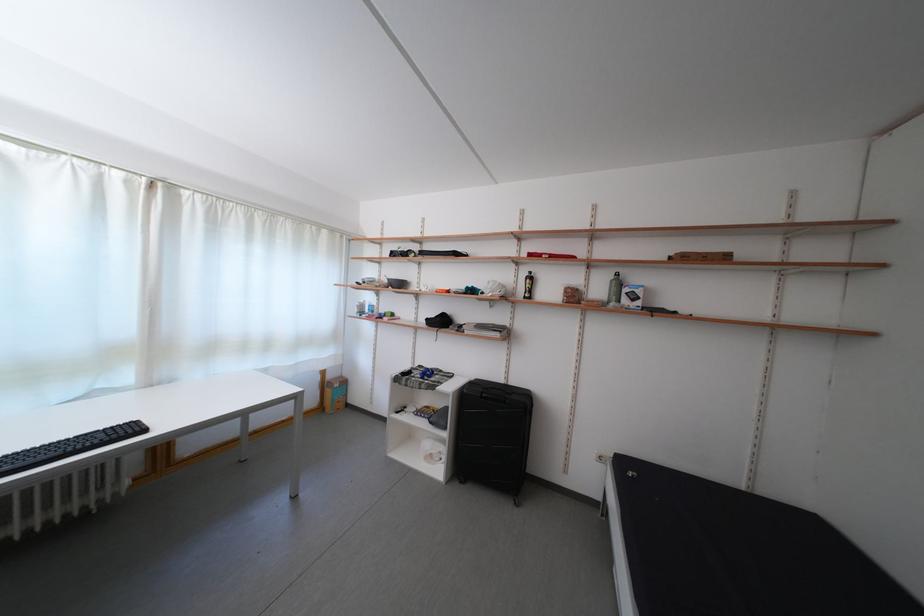
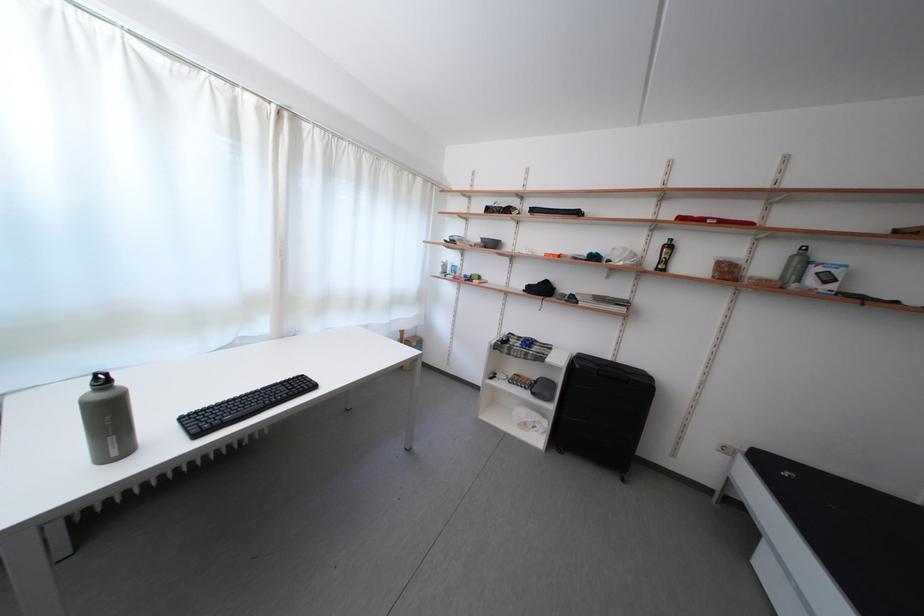
Where in the second image is the point corresponding to point 582,302 from the first image?

(736, 278)